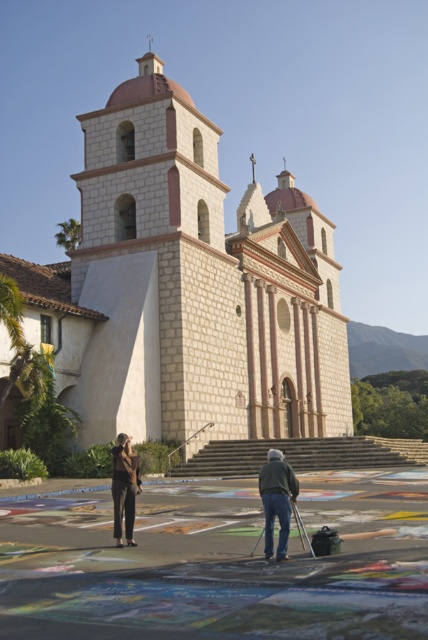
Who is positioned more to the left, dark gray jeans at center or denim jacket at lower center?

dark gray jeans at center is more to the left.

Describe the element at coordinates (278, 497) in the screenshot. I see `dark gray jeans at center` at that location.

This screenshot has height=640, width=428. Identify the location of dark gray jeans at center. (278, 497).

Does dark gray jeans at center appear on the left side of matte black pants at lower left?

No, dark gray jeans at center is not to the left of matte black pants at lower left.

Which is above, dark gray jeans at center or matte black pants at lower left?

dark gray jeans at center is above.

What are the coordinates of `dark gray jeans at center` in the screenshot? It's located at (278, 497).

Is point (285, 532) positioned before point (131, 476)?

Yes.

Who is positioned more to the right, denim jacket at lower center or matte black pants at lower left?

Positioned to the right is denim jacket at lower center.

What do you see at coordinates (276, 500) in the screenshot? I see `denim jacket at lower center` at bounding box center [276, 500].

Where is `denim jacket at lower center`? The height and width of the screenshot is (640, 428). denim jacket at lower center is located at coordinates (276, 500).